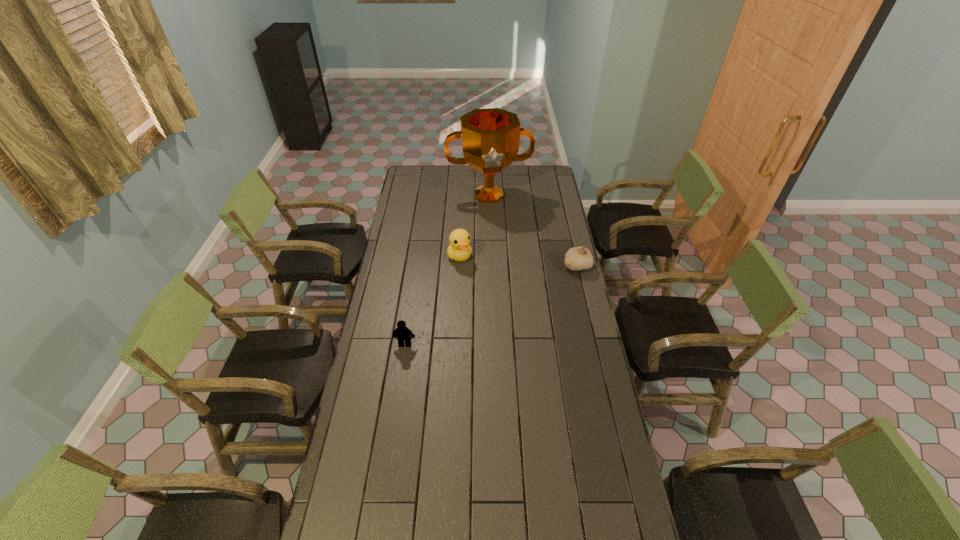
Find the location of `vacant space located 0.290m on the side of the tallest object with the star emblem`. vacant space located 0.290m on the side of the tallest object with the star emblem is located at coordinates (501, 244).

Find the location of `vacant space situated on the face of the third shortest object`. vacant space situated on the face of the third shortest object is located at coordinates coord(484,294).

You are a GUI agent. You are given a task and a screenshot of the screen. Output one action in this format:
    pyautogui.click(x=<x>, y=<y>)
    Task: Click on the free location located on the face of the third shortest object
    
    Given the screenshot: What is the action you would take?
    pyautogui.click(x=488, y=300)

This screenshot has height=540, width=960. What are the coordinates of `free space located 0.100m on the face of the third shortest object` in the screenshot? It's located at (473, 279).

I want to click on object positioned at the far edge, so click(490, 137).

The width and height of the screenshot is (960, 540). Find the location of `object that is at the left edge`. object that is at the left edge is located at coordinates (401, 333).

Find the location of a particular element. This screenshot has width=960, height=540. object at the right edge is located at coordinates (577, 258).

In order to click on blank space at the far edge of the desktop in this screenshot , I will do (468, 175).

Where is `vacant space at the near edge`? Image resolution: width=960 pixels, height=540 pixels. vacant space at the near edge is located at coordinates (428, 525).

Locate an element on the screen. The image size is (960, 540). free space at the left edge of the desktop is located at coordinates (398, 268).